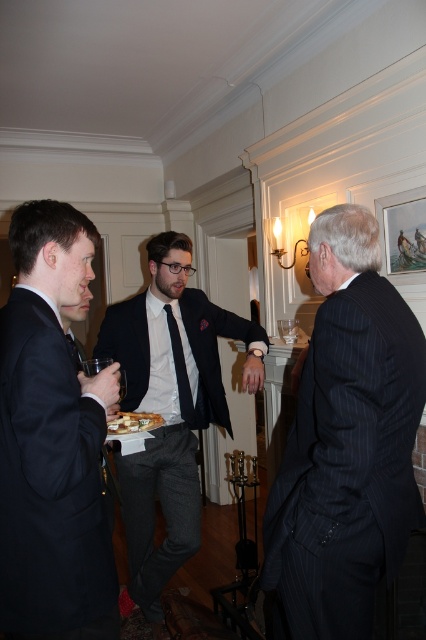
In the scene shown: Can you confirm if matte black suit at center is thinner than white glossy plate at center?

No.

Does matte black suit at center have a greater width compared to white glossy plate at center?

Yes.

This screenshot has height=640, width=426. I want to click on matte black suit at center, so click(169, 408).

The width and height of the screenshot is (426, 640). Identify the location of matte black suit at left. (51, 442).

Measure the distance between matte black suit at left and camera.

matte black suit at left is 1.05 meters away from camera.

Is point (31, 600) farther from camera compared to point (115, 419)?

No, (31, 600) is closer to viewer.

Find the location of a particular element. matte black suit at left is located at coordinates (51, 442).

Can you confirm if black silk tie at center is positioned to the right of white glossy plate at center?

Yes, black silk tie at center is to the right of white glossy plate at center.

Locate an element on the screen. The image size is (426, 640). black silk tie at center is located at coordinates (180, 369).